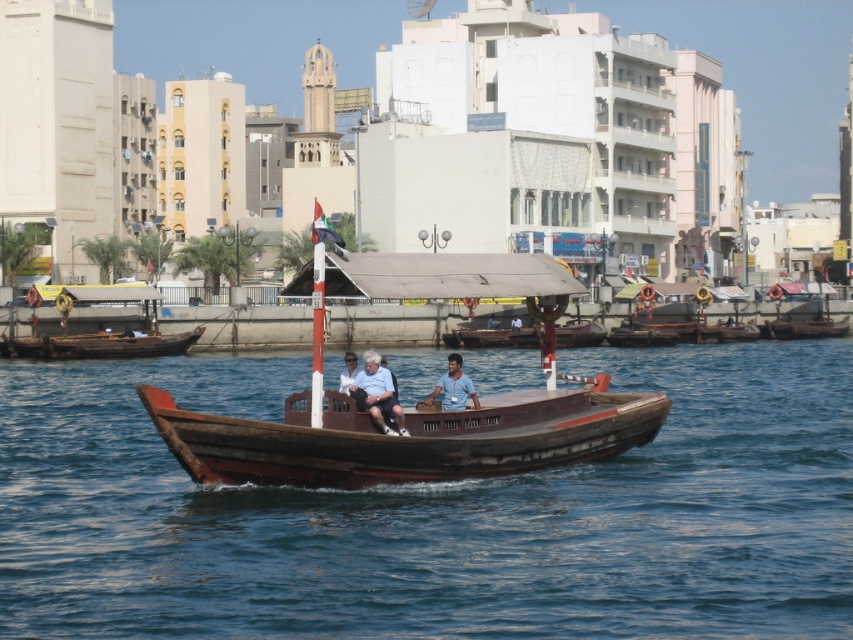
Question: Is rustic wood boat at center below blue fabric shirt at center?

Choices:
 (A) no
 (B) yes

Answer: (A)

Question: Which point is closer to the camera?

Choices:
 (A) wooden boat at left
 (B) wooden boat at center
 (C) brown wooden boat at center

Answer: (C)

Question: Which object is closer to the camera taking this photo?

Choices:
 (A) wooden boat at left
 (B) matte black shirt at center
 (C) rustic wood boat at center
 (D) wooden boat at center

Answer: (C)

Question: Does rustic wood boat at center lie in front of wooden boat at center?

Choices:
 (A) yes
 (B) no

Answer: (A)

Question: Which point is farther to the camera?

Choices:
 (A) (416, 625)
 (B) (563, 332)
 (C) (445, 388)
 (D) (374, 374)

Answer: (B)

Question: Can you confirm if rustic wood boat at center is positioned below wooden boat at center?

Choices:
 (A) no
 (B) yes

Answer: (A)